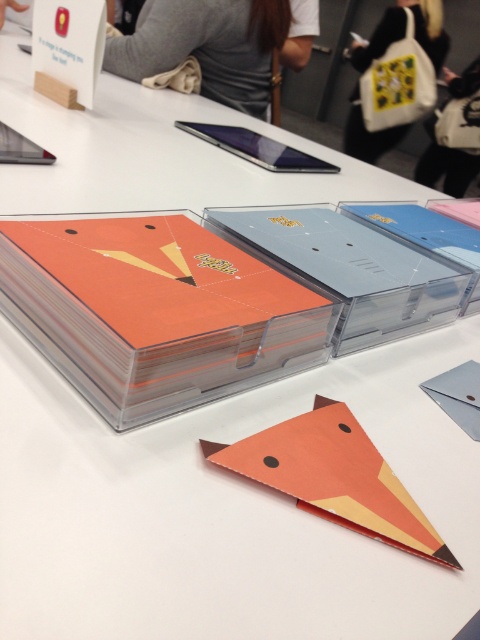
Which of these two, transparent plastic box at center or gray fabric shirt at upper center, stands shorter?

transparent plastic box at center is shorter.

Is transparent plastic box at center positioned in front of gray fabric shirt at upper center?

Yes, transparent plastic box at center is closer to the viewer.

Who is more forward, (396, 291) or (106, 65)?

Point (396, 291) is more forward.

The width and height of the screenshot is (480, 640). Identify the location of transparent plastic box at center. 350,269.

Based on the photo, which is below, transparent plastic box at center or white fabric bag at upper right?

transparent plastic box at center is below.

Is transparent plastic box at center to the right of white fabric bag at upper right from the viewer's perspective?

In fact, transparent plastic box at center is to the left of white fabric bag at upper right.

Identify the location of transparent plastic box at center. (350, 269).

How distant is orange matte card at center from gray fabric shirt at upper center?

5.53 feet

Which is in front, point (240, 317) or point (168, 45)?

Positioned in front is point (240, 317).

Locate an element on the screen. The image size is (480, 640). orange matte card at center is located at coordinates (156, 310).

This screenshot has height=640, width=480. I want to click on orange matte card at center, so click(156, 310).